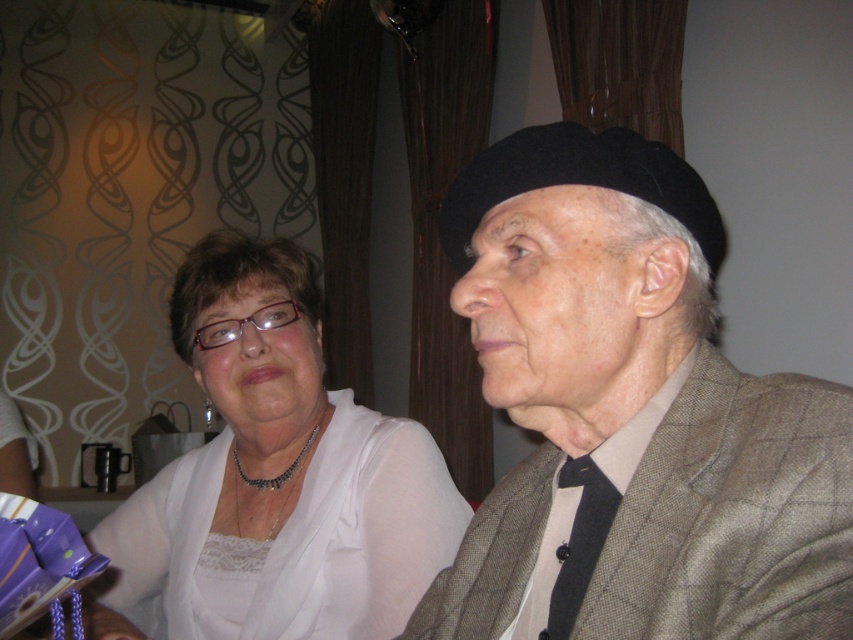
Can you confirm if matte black beret at upper right is bigger than white satin blouse at center?

No, matte black beret at upper right is not bigger than white satin blouse at center.

The image size is (853, 640). Find the location of `matte black beret at upper right`. matte black beret at upper right is located at coordinates (631, 416).

Does point (724, 452) lie behind point (152, 516)?

That is False.

Identify the location of matte black beret at upper right. (631, 416).

Which is in front, point (538, 547) or point (563, 483)?

Point (563, 483)

Consider the image. Between matte black beret at upper right and black textured tie at center, which one appears on the left side from the viewer's perspective?

From the viewer's perspective, matte black beret at upper right appears more on the left side.

Which is in front, point (601, 321) or point (593, 465)?

Point (601, 321) is more forward.

Identify the location of matte black beret at upper right. tap(631, 416).

Between white satin blouse at center and black textured tie at center, which one is positioned higher?

white satin blouse at center is above.

Is point (444, 515) closer to camera compared to point (595, 493)?

No, (444, 515) is further to viewer.

Where is `white satin blouse at center`? The height and width of the screenshot is (640, 853). white satin blouse at center is located at coordinates (279, 474).